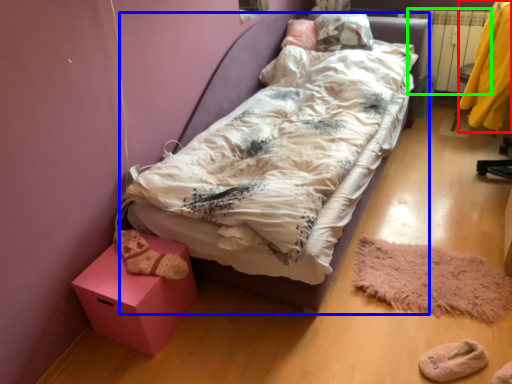
Question: Estimate the real-world distances between objects in this image. Which object is closer to clothing (highlighted by a red box), bed (highlighted by a blue box) or radiator (highlighted by a green box)?

Choices:
 (A) bed
 (B) radiator

Answer: (B)